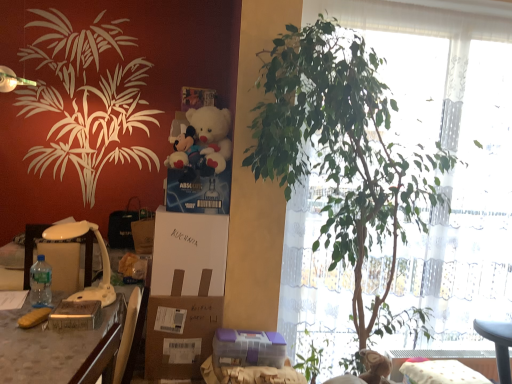
Question: Considering the relative sizes of clear plastic bottle at left and white cardboard box at center in the image provided, is clear plastic bottle at left taller than white cardboard box at center?

Choices:
 (A) no
 (B) yes

Answer: (A)

Question: Does clear plastic bottle at left have a greater width compared to white cardboard box at center?

Choices:
 (A) yes
 (B) no

Answer: (B)

Question: Is clear plastic bottle at left next to white cardboard box at center?

Choices:
 (A) no
 (B) yes

Answer: (A)

Question: From the image's perspective, is clear plastic bottle at left located above white cardboard box at center?

Choices:
 (A) no
 (B) yes

Answer: (A)

Question: From the image's perspective, does clear plastic bottle at left appear lower than white cardboard box at center?

Choices:
 (A) yes
 (B) no

Answer: (A)

Question: Considering the relative sizes of clear plastic bottle at left and white cardboard box at center in the image provided, is clear plastic bottle at left shorter than white cardboard box at center?

Choices:
 (A) no
 (B) yes

Answer: (B)

Question: Is wooden desk at left smaller than white plush teddy bear at upper center?

Choices:
 (A) no
 (B) yes

Answer: (A)

Question: Considering the relative sizes of wooden desk at left and white plush teddy bear at upper center in the image provided, is wooden desk at left wider than white plush teddy bear at upper center?

Choices:
 (A) yes
 (B) no

Answer: (A)

Question: Is wooden desk at left next to white plush teddy bear at upper center and touching it?

Choices:
 (A) yes
 (B) no

Answer: (B)

Question: From a real-world perspective, does wooden desk at left sit lower than white plush teddy bear at upper center?

Choices:
 (A) yes
 (B) no

Answer: (A)

Question: Is wooden desk at left to the right of white plush teddy bear at upper center from the viewer's perspective?

Choices:
 (A) yes
 (B) no

Answer: (B)

Question: Can you confirm if wooden desk at left is thinner than white plush teddy bear at upper center?

Choices:
 (A) yes
 (B) no

Answer: (B)

Question: Is white cardboard box at center positioned with its back to white plastic lamp at left?

Choices:
 (A) no
 (B) yes

Answer: (A)